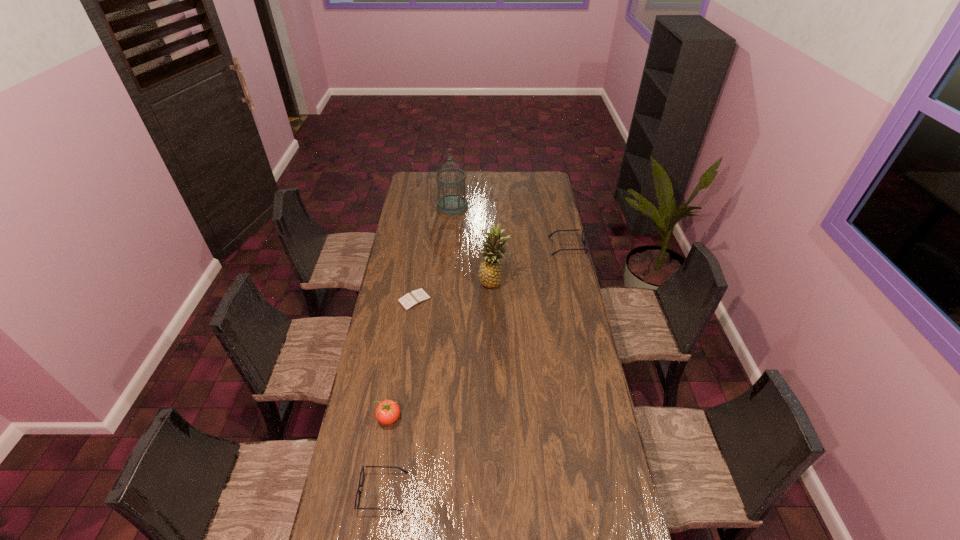
Find the location of a particular element. This screenshot has height=540, width=960. vacant area that lies between the fifth tallest object and the birdcage is located at coordinates [418, 349].

What are the coordinates of `unoccupied position between the third tallest object and the farthest object` in the screenshot? It's located at (420, 312).

Locate an element on the screen. free space that is in between the third tallest object and the fifth object from left to right is located at coordinates (442, 349).

Identify which object is located as the third nearest to the third tallest object. Please provide its 2D coordinates. Your answer should be formatted as a tuple, i.e. [(x, y)], where the tuple contains the x and y coordinates of a point satisfying the conditions above.

[(490, 271)]

Image resolution: width=960 pixels, height=540 pixels. I want to click on object that stands as the closest to the taller spectacles, so click(x=490, y=271).

Image resolution: width=960 pixels, height=540 pixels. What are the coordinates of `vacant space that satisfies the following two spatial constraints: 1. on the front-facing side of the birdcage; 2. on the left side of the fifth object from left to right` in the screenshot? It's located at (446, 281).

This screenshot has height=540, width=960. I want to click on vacant region that satisfies the following two spatial constraints: 1. on the front-facing side of the birdcage; 2. on the front-facing side of the shorter spectacles, so [429, 492].

Identify the location of free space that satisfies the following two spatial constraints: 1. on the front-facing side of the farthest object; 2. on the left side of the second object from right to left. (446, 281).